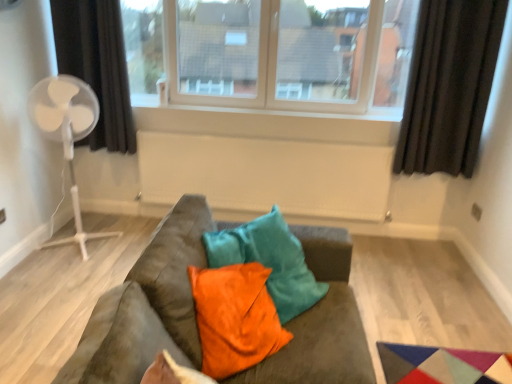
Question: From their relative heights in the image, would you say suede-like brown couch at center is taller or shorter than white plastic window sill at upper center?

Choices:
 (A) tall
 (B) short

Answer: (A)

Question: From a real-world perspective, relative to white plastic window sill at upper center, is suede-like brown couch at center vertically above or below?

Choices:
 (A) above
 (B) below

Answer: (B)

Question: Which of these objects is positioned closest to the orange velvet pillow at center?

Choices:
 (A) transparent glass window at center
 (B) white plastic fan at left
 (C) black fabric curtain at right, the 1th curtain from the right
 (D) black fabric curtain at left, positioned as the 2th curtain in right-to-left order
 (E) suede-like brown couch at center

Answer: (E)

Question: Based on their relative distances, which object is farther from the orange velvet pillow at center?

Choices:
 (A) white matte radiator at center
 (B) black fabric curtain at right, the 1th curtain from the right
 (C) suede-like brown couch at center
 (D) white plastic window sill at upper center
 (E) white plastic fan at left

Answer: (B)